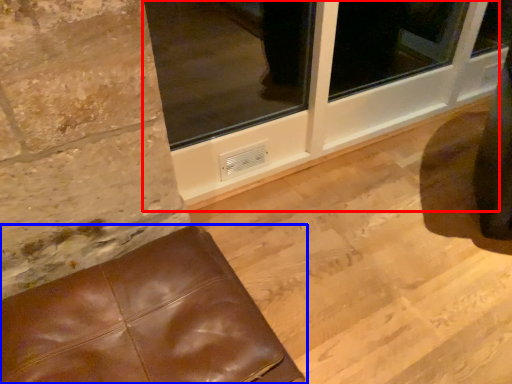
Question: Which object is further to the camera taking this photo, window frame (highlighted by a red box) or furniture (highlighted by a blue box)?

Choices:
 (A) window frame
 (B) furniture

Answer: (A)